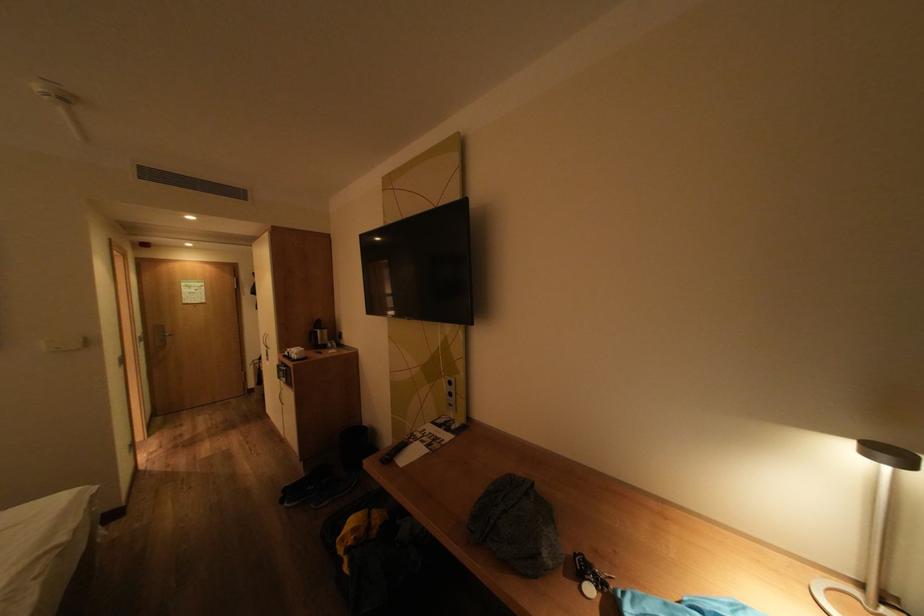
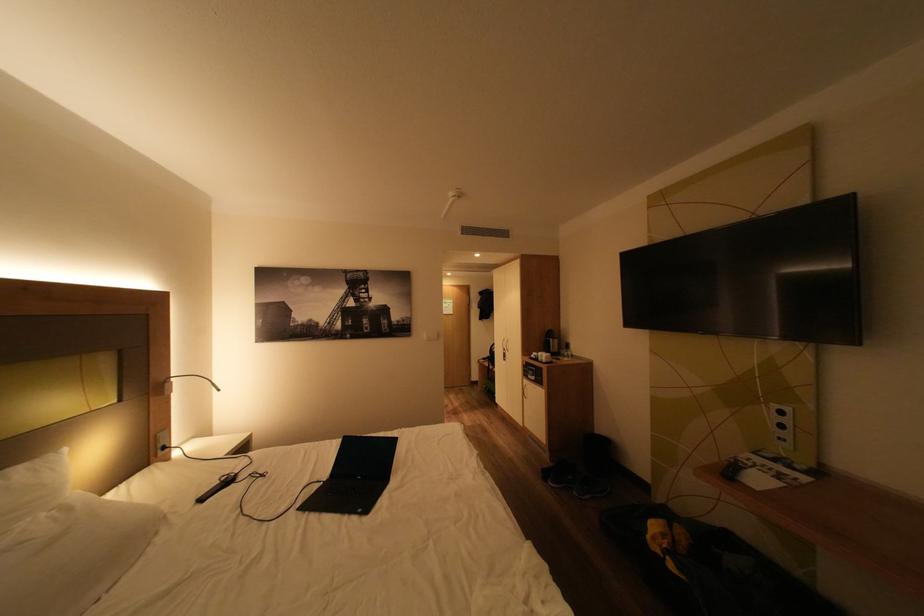
Locate, in the second image, the point that corresponds to pixel 304 350 in the first image.

(551, 354)